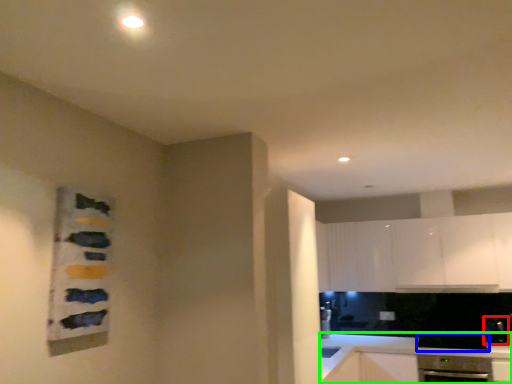
Question: Based on their relative distances, which object is nearer to appliance (highlighted by a red box)? Choose from appliance (highlighted by a blue box) and countertop (highlighted by a green box).

Choices:
 (A) appliance
 (B) countertop

Answer: (A)